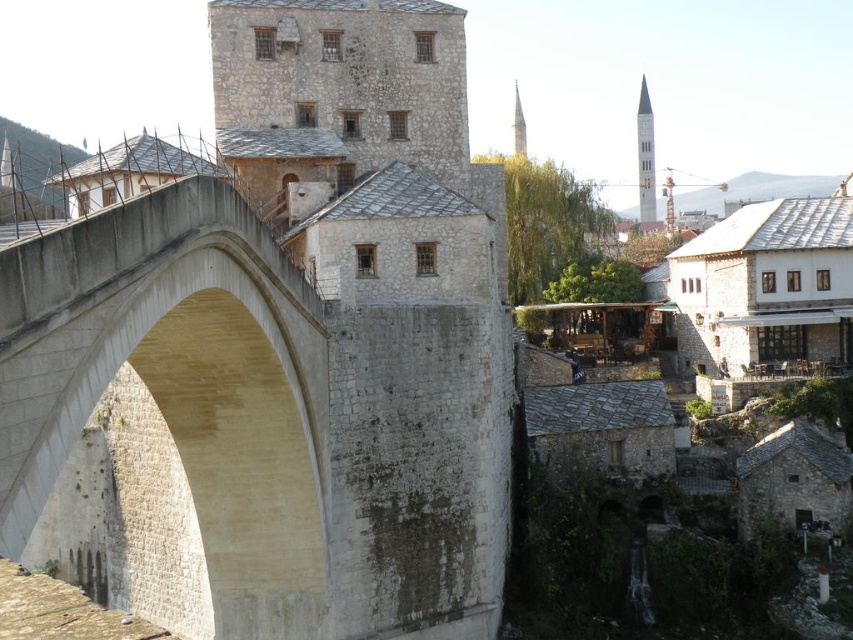
Does beige stone arch bridge at left have a greater width compared to white stone tower at upper center?

No, beige stone arch bridge at left is not wider than white stone tower at upper center.

Is point (254, 513) more distant than point (648, 132)?

That is False.

This screenshot has height=640, width=853. I want to click on beige stone arch bridge at left, so click(x=180, y=385).

Is white stone tower at upper center below smooth white minaret at upper center?

Correct, white stone tower at upper center is located below smooth white minaret at upper center.

Who is shorter, white stone tower at upper center or smooth white minaret at upper center?

Standing shorter between the two is white stone tower at upper center.

Does point (653, 179) come behind point (523, 154)?

Yes, point (653, 179) is behind point (523, 154).

Where is `white stone tower at upper center`? white stone tower at upper center is located at coordinates (645, 156).

Which is more to the right, beige stone arch bridge at left or smooth white minaret at upper center?

smooth white minaret at upper center is more to the right.

Which of these two, beige stone arch bridge at left or smooth white minaret at upper center, stands shorter?

Standing shorter between the two is beige stone arch bridge at left.

Which is in front, point (70, 310) or point (517, 148)?

Point (70, 310) is in front.

Find the location of a particular element. beige stone arch bridge at left is located at coordinates (180, 385).